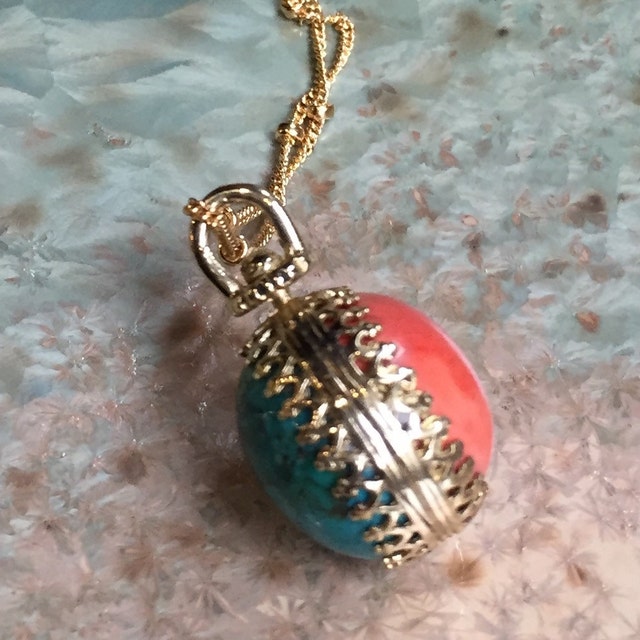
Identify the location of ornamentation. Image resolution: width=640 pixels, height=640 pixels. (358, 496), (379, 374).